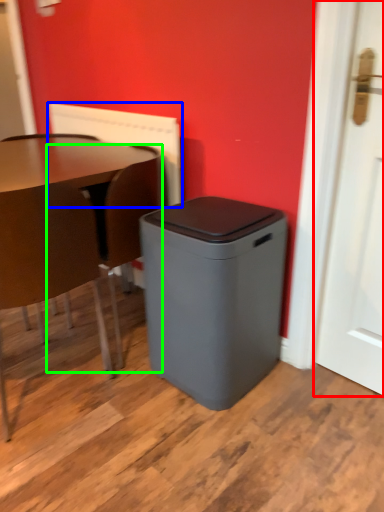
Question: Based on their relative distances, which object is nearer to door (highlighted by a red box)? Choose from radiator (highlighted by a blue box) and swivel chair (highlighted by a green box).

Choices:
 (A) radiator
 (B) swivel chair

Answer: (B)